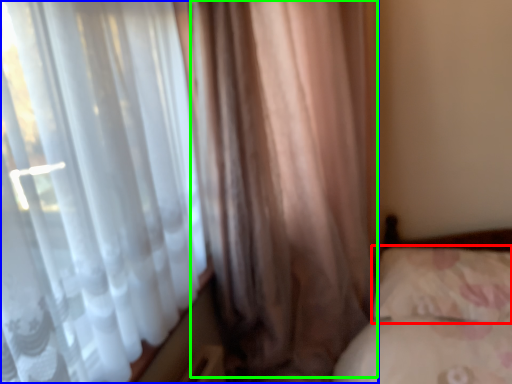
Question: Based on their relative distances, which object is farther from pillow (highlighted by a red box)? Choose from curtain (highlighted by a blue box) and curtain (highlighted by a green box).

Choices:
 (A) curtain
 (B) curtain

Answer: (A)